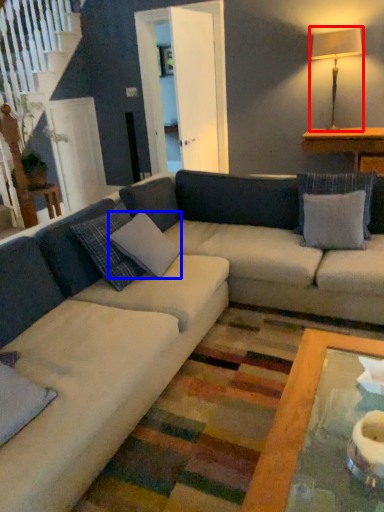
Question: Which object is closer to the camera taking this photo, table lamp (highlighted by a red box) or pillow (highlighted by a blue box)?

Choices:
 (A) table lamp
 (B) pillow

Answer: (B)